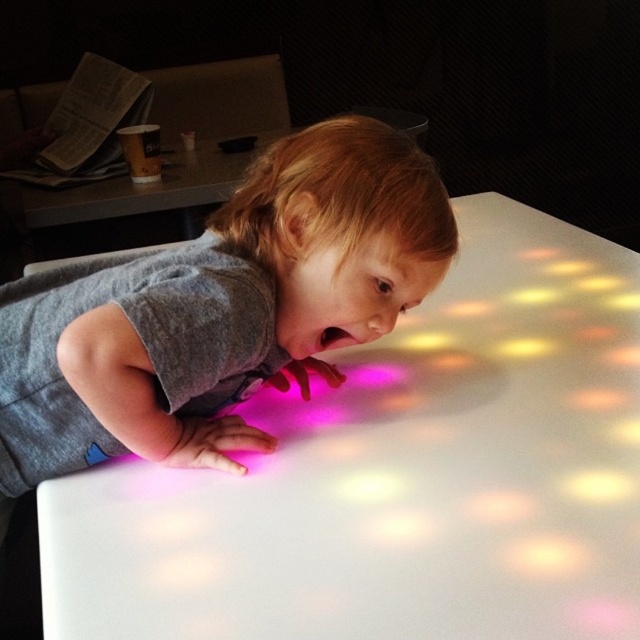
Question: Which of the following is the closest to the observer?

Choices:
 (A) (198, 451)
 (B) (573, 488)

Answer: (B)

Question: Does white glossy table at center appear on the right side of gray matte shirt at center?

Choices:
 (A) no
 (B) yes

Answer: (B)

Question: Can you confirm if white glossy table at center is wider than gray matte shirt at center?

Choices:
 (A) yes
 (B) no

Answer: (A)

Question: Can you confirm if white glossy table at center is thinner than gray matte shirt at center?

Choices:
 (A) no
 (B) yes

Answer: (A)